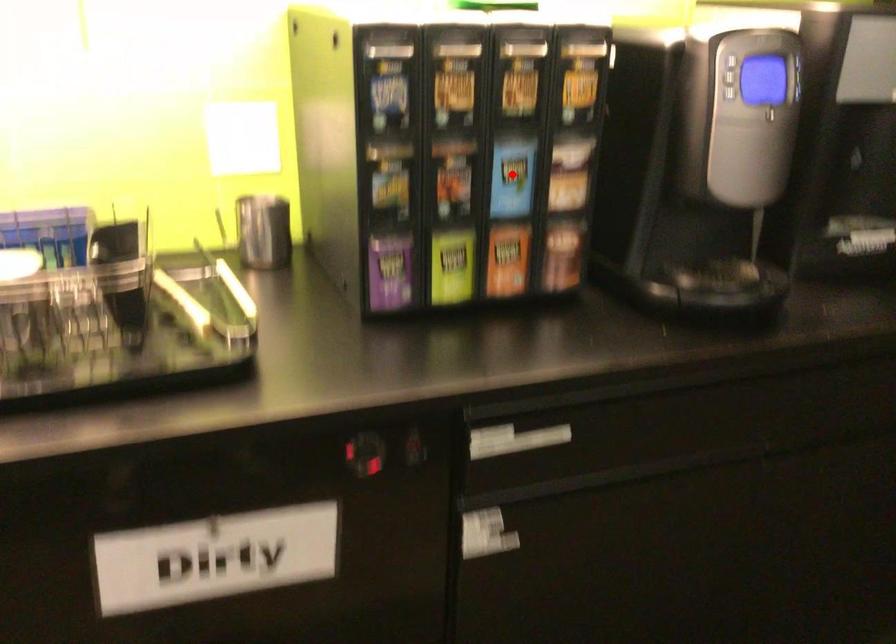
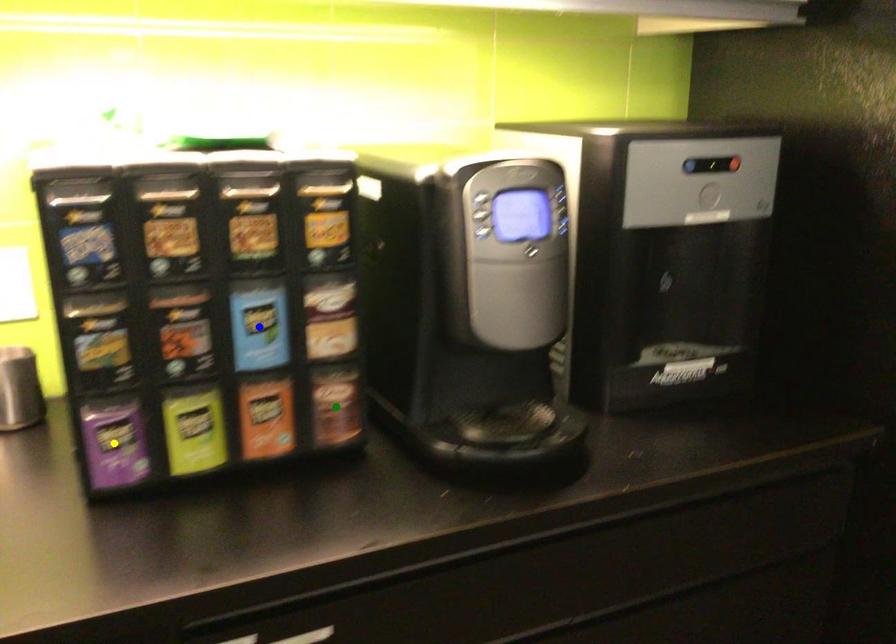
Question: I am providing you with two images of the same scene from different viewpoints. A red point is marked on the first image. You are given multiple points on the second image. In image 2, which mark is for the same physical point as the one in image 1?

Choices:
 (A) yellow point
 (B) blue point
 (C) green point

Answer: (B)